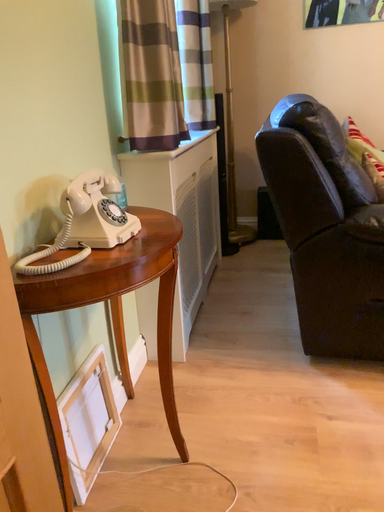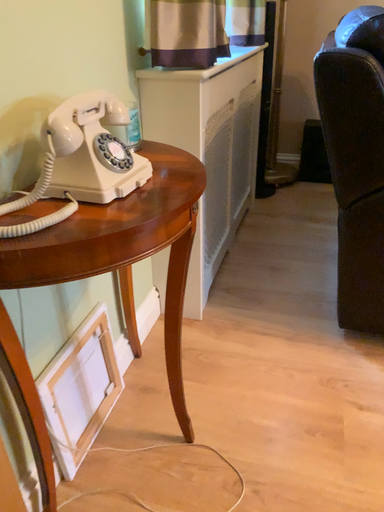
Question: How did the camera likely rotate when shooting the video?

Choices:
 (A) rotated upward
 (B) rotated downward

Answer: (B)